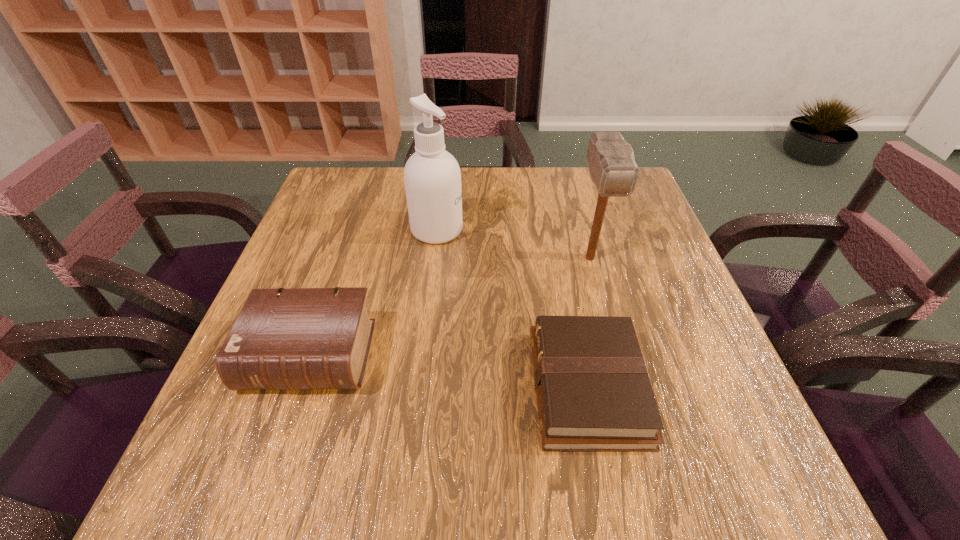
Identify the location of free space that is in between the third object from right to left and the shorter Bible. (512, 308).

The width and height of the screenshot is (960, 540). Find the location of `free spot between the mallet and the left Bible`. free spot between the mallet and the left Bible is located at coordinates (450, 306).

I want to click on object that is the closest one to the shortest object, so click(x=612, y=166).

This screenshot has width=960, height=540. In order to click on object that ranks as the second closest to the mallet in this screenshot , I will do `click(432, 177)`.

Identify the location of vacant space that satisfies the following two spatial constraints: 1. on the front label of the second object from left to right; 2. on the spine side of the taller Bible. (422, 355).

Identify the location of free region that satisfies the following two spatial constraints: 1. on the front label of the second object from left to right; 2. on the spine side of the third tallest object. (422, 355).

At what (x,y) coordinates should I click in order to perform the action: click on vacant region that satisfies the following two spatial constraints: 1. on the front label of the third object from right to left; 2. on the spine side of the taller Bible. Please return your answer as a coordinate pair (x, y). The height and width of the screenshot is (540, 960). Looking at the image, I should click on point(422,355).

You are a GUI agent. You are given a task and a screenshot of the screen. Output one action in this format:
    pyautogui.click(x=<x>, y=<y>)
    Task: Click on the free space in the image that satisfies the following two spatial constraints: 1. on the striking face of the third shortest object; 2. on the spine side of the shorter Bible
    The image size is (960, 540).
    Given the screenshot: What is the action you would take?
    pyautogui.click(x=625, y=387)

At what (x,y) coordinates should I click in order to perform the action: click on vacant space that satisfies the following two spatial constraints: 1. on the striking face of the second tallest object; 2. on the spine side of the shortest object. Please return your answer as a coordinate pair (x, y). Looking at the image, I should click on (625, 387).

In order to click on free point that satisfies the following two spatial constraints: 1. on the front label of the cleansing agent; 2. on the spine side of the taller Bible in this screenshot , I will do `click(422, 355)`.